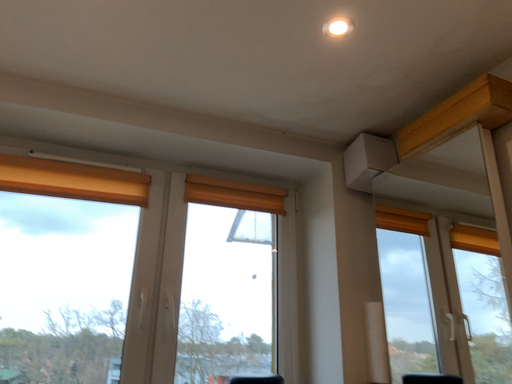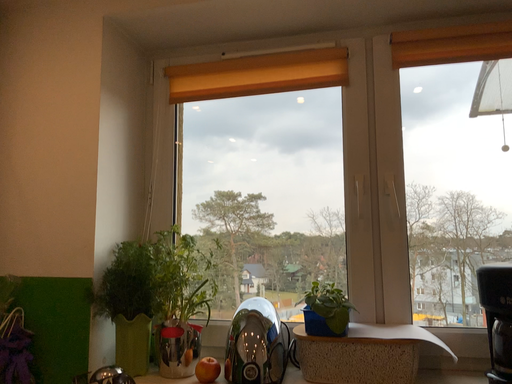
Question: Which way did the camera rotate in the video?

Choices:
 (A) rotated right
 (B) rotated left

Answer: (B)